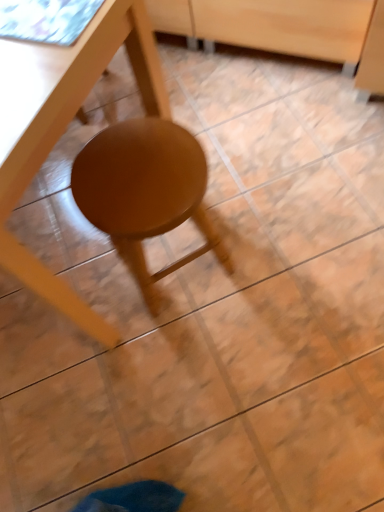
You are a GUI agent. You are given a task and a screenshot of the screen. Output one action in this format:
    pyautogui.click(x=<x>, y=<y>)
    Task: Click on the free location to the left of matte wood stool at center
    Image resolution: width=384 pixels, height=512 pixels.
    Given the screenshot: What is the action you would take?
    pyautogui.click(x=60, y=313)